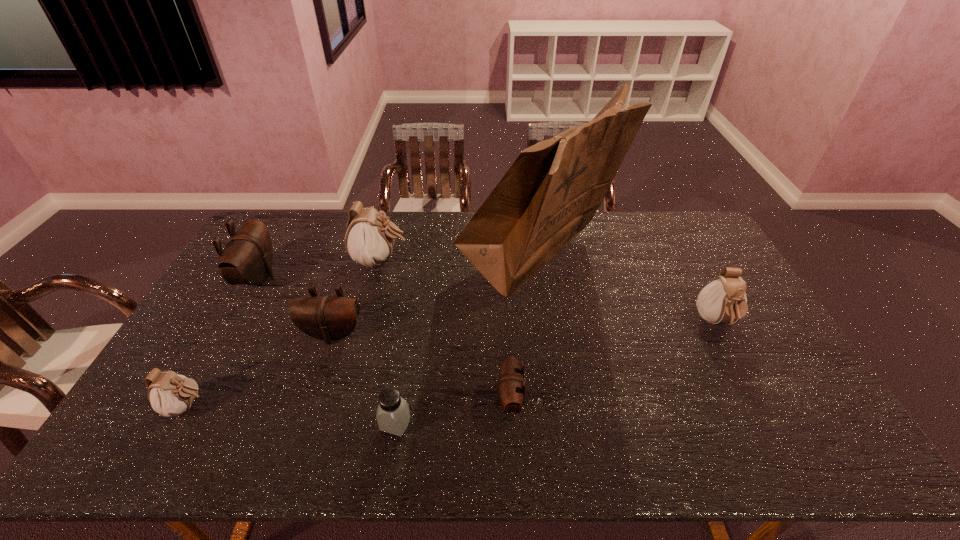
Identify which brown pouch is the closest to the farthest white pouch. Please provide its 2D coordinates. Your answer should be formatted as a tuple, i.e. [(x, y)], where the tuple contains the x and y coordinates of a point satisfying the conditions above.

[(328, 318)]

I want to click on vacant position in the image that satisfies the following two spatial constraints: 1. with the flap open on the second brown pouch from right to left; 2. on the front-facing side of the leftmost white pouch, so click(x=309, y=407).

You are a GUI agent. You are given a task and a screenshot of the screen. Output one action in this format:
    pyautogui.click(x=<x>, y=<y>)
    Task: Click on the free location that satisfies the following two spatial constraints: 1. on the front-facing side of the rightmost object; 2. on the front-facing side of the nearest white pouch
    This screenshot has height=540, width=960.
    Given the screenshot: What is the action you would take?
    click(761, 407)

Image resolution: width=960 pixels, height=540 pixels. Identify the location of vacant area that satisfies the following two spatial constraints: 1. with the flap open on the second brown pouch from right to left; 2. on the front-facing side of the leftmost white pouch. (309, 407).

Identify the location of blank area in the image that satisfies the following two spatial constraints: 1. on the front-facing side of the grocery bag; 2. on the left side of the second white pouch from left to right. The image size is (960, 540). (380, 263).

Identify the location of vacant region that satisfies the following two spatial constraints: 1. on the front-facing side of the nearest white pouch; 2. on the back side of the saltshaker. The image size is (960, 540). 179,424.